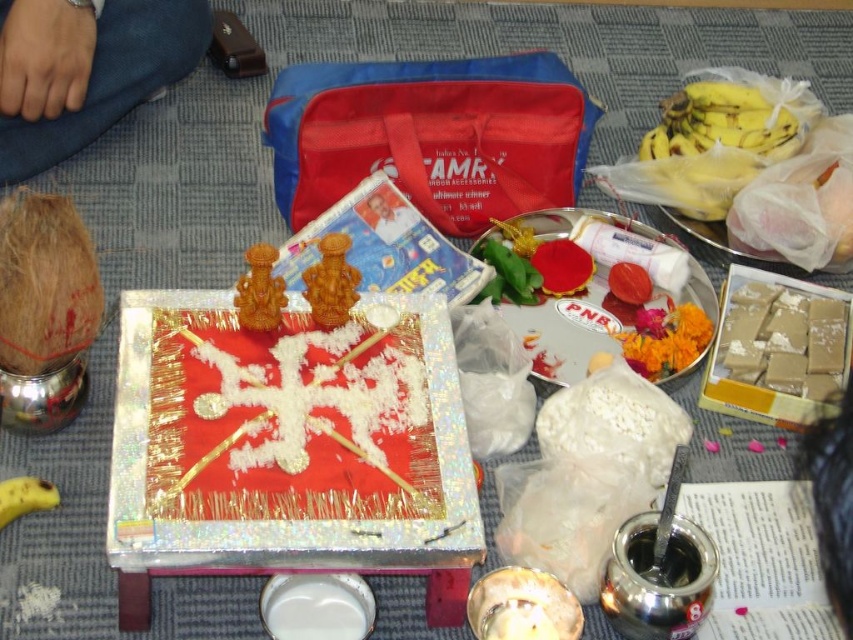
Question: Observing the image, what is the correct spatial positioning of red fabric bag at center in reference to yellow matte banana at lower left?

Choices:
 (A) above
 (B) below

Answer: (A)

Question: Does red fabric bag at center lie in front of yellow matte banana at lower left?

Choices:
 (A) no
 (B) yes

Answer: (A)

Question: Which object is positioned closest to the yellow plastic bag at upper right?

Choices:
 (A) metallic silver tray at center right
 (B) red fabric bag at center

Answer: (A)

Question: Which object is closer to the camera taking this photo?

Choices:
 (A) black hair at upper right
 (B) blue denim jeans at upper left
 (C) yellow plastic bag at upper right
 (D) metallic silver tray at center right

Answer: (A)

Question: Based on their relative distances, which object is nearer to the red fabric bag at center?

Choices:
 (A) smooth brown rectangular blocks at center right
 (B) black hair at upper right
 (C) yellow matte banana at lower left
 (D) blue denim jeans at upper left

Answer: (D)

Question: Is blue denim jeans at upper left to the right of yellow plastic bag at upper right from the viewer's perspective?

Choices:
 (A) no
 (B) yes

Answer: (A)